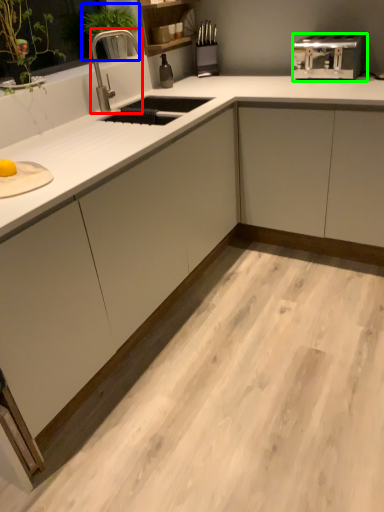
Question: Which object is positioned closest to faucet (highlighted by a red box)? Select from plant (highlighted by a blue box) and toaster (highlighted by a green box).

Choices:
 (A) plant
 (B) toaster

Answer: (A)